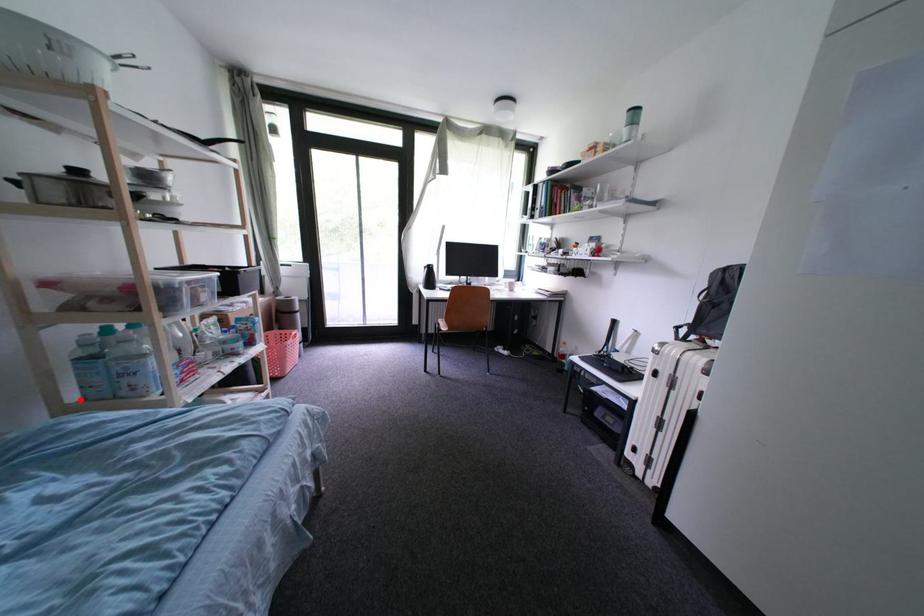
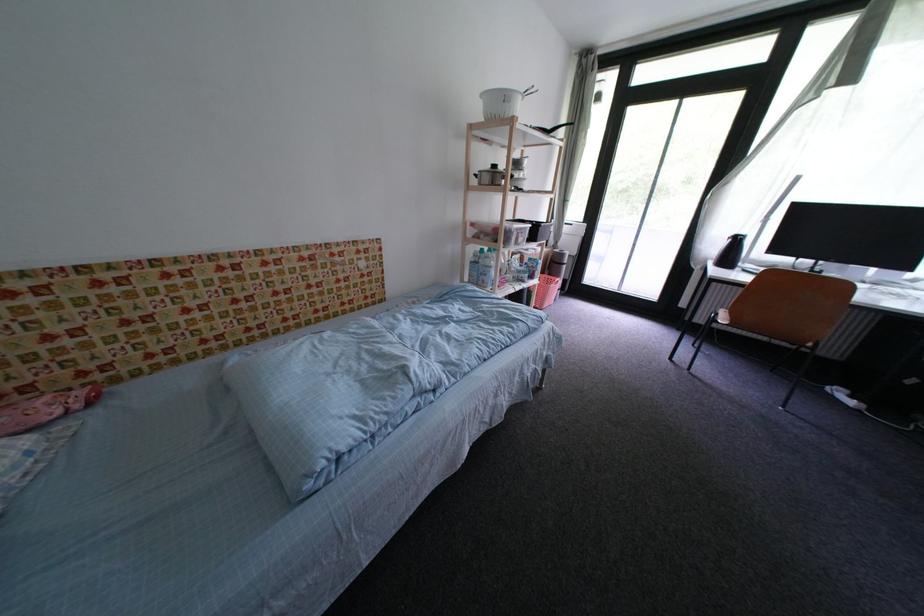
The point at the highlighted location is marked in the first image. Where is the corresponding point in the second image?

(475, 281)